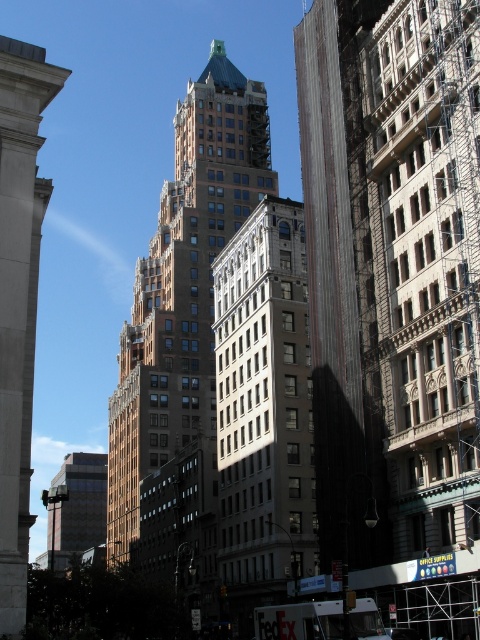
You are an urban planner evaluating the space between two central buildings in the image. The brown stone tower at center and the dark brown brick building at center. Which one has a bigger footprint in the scene?

The brown stone tower at center is larger in size than the dark brown brick building at center, so it has a bigger footprint in the scene.

You are a city planner who needs to install a new 40 feet wide billboard between the dark brown brick building at center and the white stone building at center. Based on the given information, will the billboard fit between them?

The distance between the dark brown brick building at center and the white stone building at center is 39.57 feet, which is slightly less than the 40 feet width of the billboard. Therefore, the billboard will not fit between them.